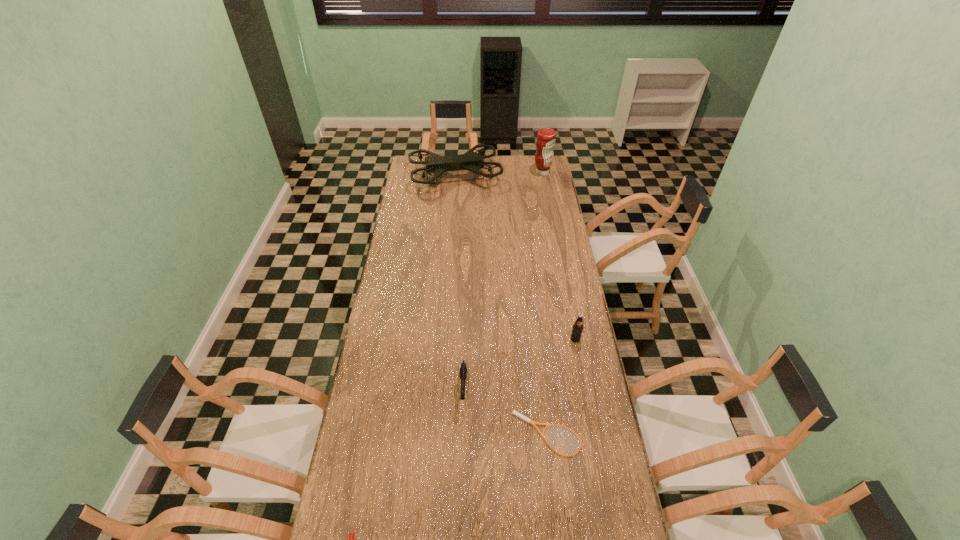
This screenshot has width=960, height=540. I want to click on drone, so click(472, 161).

The image size is (960, 540). What are the coordinates of `condiment` in the screenshot? It's located at (546, 139).

Where is `pop`? pop is located at coordinates (577, 329).

The height and width of the screenshot is (540, 960). In order to click on the fourth nearest object in this screenshot , I will do `click(577, 329)`.

Where is `the fourth farthest object`? The height and width of the screenshot is (540, 960). the fourth farthest object is located at coordinates (463, 370).

The height and width of the screenshot is (540, 960). Find the location of `the fourth tallest object`. the fourth tallest object is located at coordinates (463, 370).

Locate an element on the screen. This screenshot has height=540, width=960. the farther tennis racket is located at coordinates pyautogui.click(x=514, y=412).

I want to click on the fifth farthest object, so click(514, 412).

Find the location of `vacant space situated 0.110m on the right of the drone`. vacant space situated 0.110m on the right of the drone is located at coordinates (520, 176).

Locate an element on the screen. This screenshot has height=540, width=960. vacant space located 0.070m on the back of the condiment is located at coordinates (540, 161).